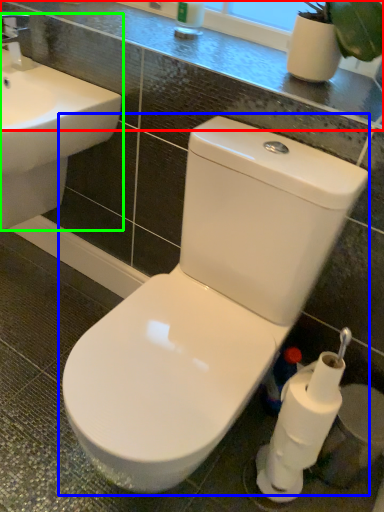
Question: Estimate the real-world distances between objects in this image. Which object is farther from counter top (highlighted by a red box), toilet (highlighted by a blue box) or sink (highlighted by a green box)?

Choices:
 (A) toilet
 (B) sink

Answer: (A)